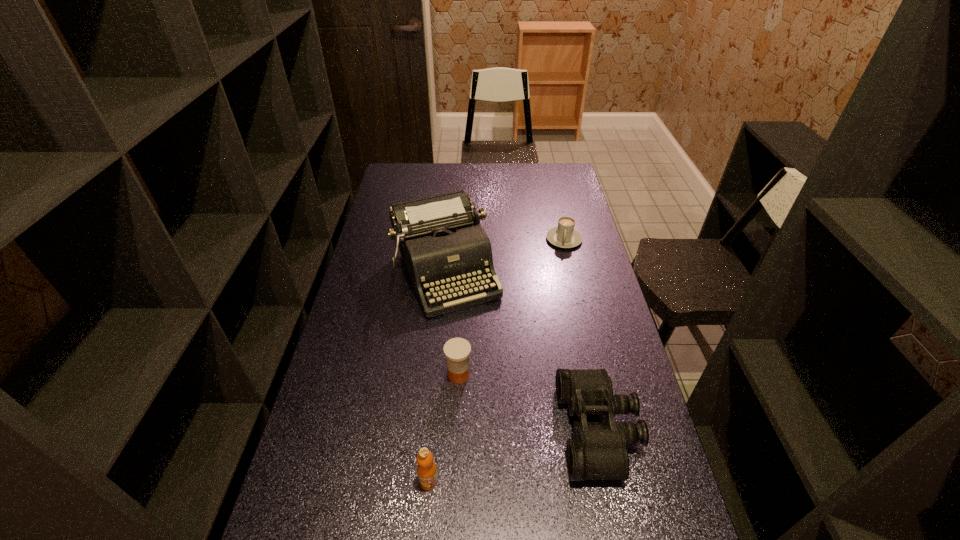
Locate an element on the screen. The height and width of the screenshot is (540, 960). orange juice is located at coordinates (427, 473).

Identify the location of binoculars. click(x=598, y=451).

Find the location of `cappuccino`. cappuccino is located at coordinates (565, 236).

You are a GUI agent. You are given a task and a screenshot of the screen. Output one action in this format:
    pyautogui.click(x=<x>, y=<y>)
    Task: Click on the tallest object
    Image resolution: width=960 pixels, height=540 pixels.
    Given the screenshot: What is the action you would take?
    pyautogui.click(x=444, y=247)

Where is `medicine`? Image resolution: width=960 pixels, height=540 pixels. medicine is located at coordinates (456, 350).

Where is `blank area located on the front label of the fourth shortest object`? blank area located on the front label of the fourth shortest object is located at coordinates (425, 528).

In order to click on vacant region located 0.400m at the eyepieces of the binoculars in this screenshot , I will do `click(410, 430)`.

Locate an element on the screen. The image size is (960, 540). blank area located at the eyepieces of the binoculars is located at coordinates (418, 430).

You are a GUI agent. You are given a task and a screenshot of the screen. Output one action in this format:
    pyautogui.click(x=<x>, y=<y>)
    Task: Click on the blank space located at the eyepieces of the binoculars
    This screenshot has width=960, height=540.
    Given the screenshot: What is the action you would take?
    (x=467, y=430)

The width and height of the screenshot is (960, 540). In order to click on blank area located 0.170m to the right of the cappuccino in this screenshot , I will do `click(559, 279)`.